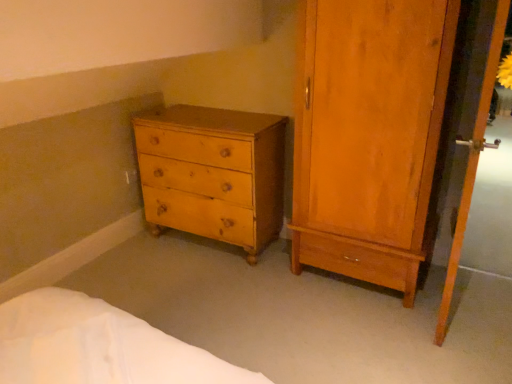
Where is `spots to the right of wooden screen door at right`? The image size is (512, 384). spots to the right of wooden screen door at right is located at coordinates (484, 304).